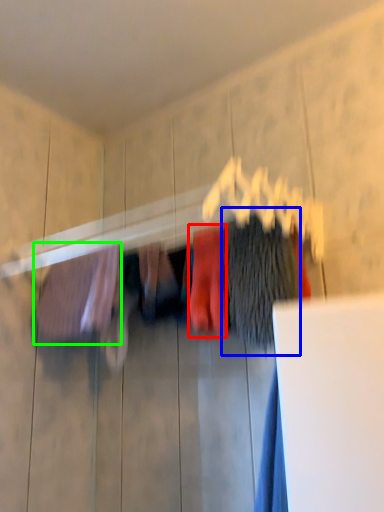
Question: Which object is the closest to the clothing (highlighted by a red box)? Choose among these: clothing (highlighted by a blue box) or clothing (highlighted by a green box).

Choices:
 (A) clothing
 (B) clothing

Answer: (A)